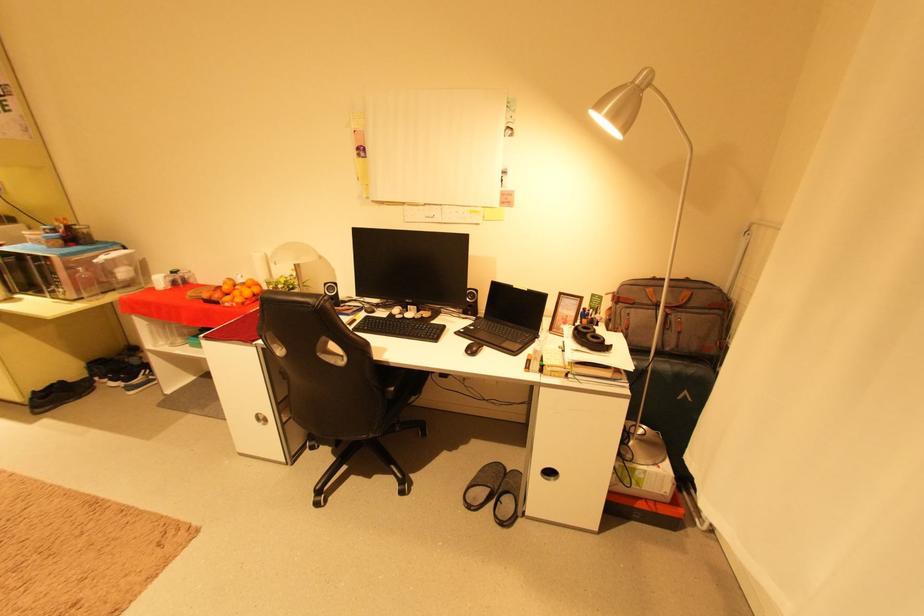
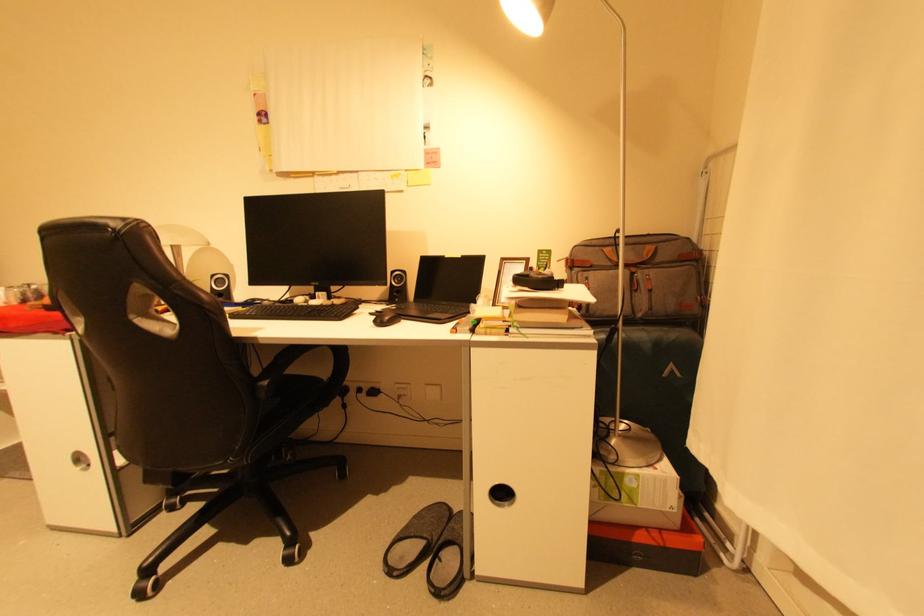
The images are taken continuously from a first-person perspective. In which direction are you moving?

The cameraman walked toward right, forward.